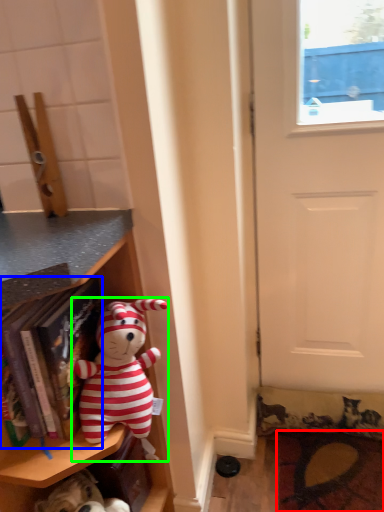
Question: Which object is positioned farthest from doormat (highlighted by a red box)? Select from book (highlighted by a blue box) and toy (highlighted by a green box).

Choices:
 (A) book
 (B) toy

Answer: (A)